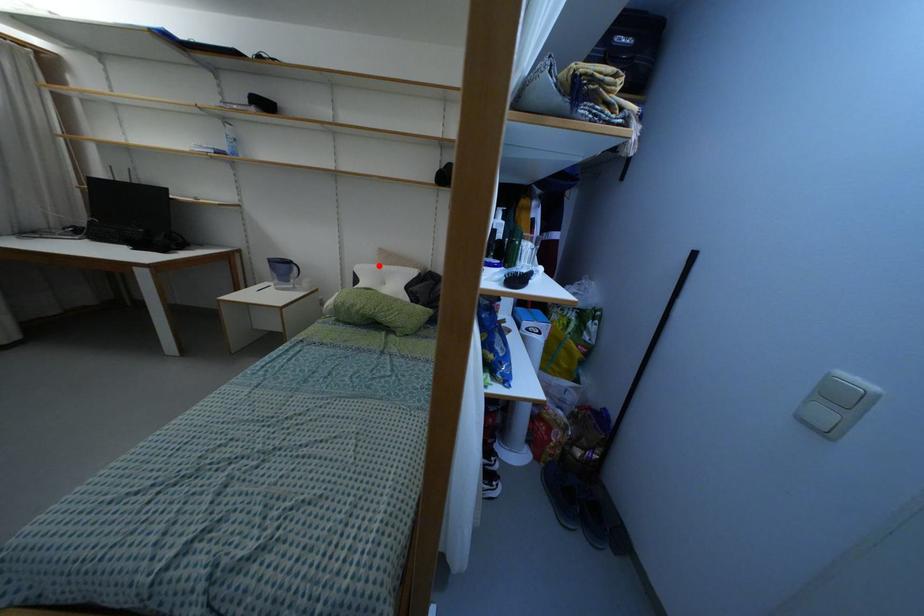
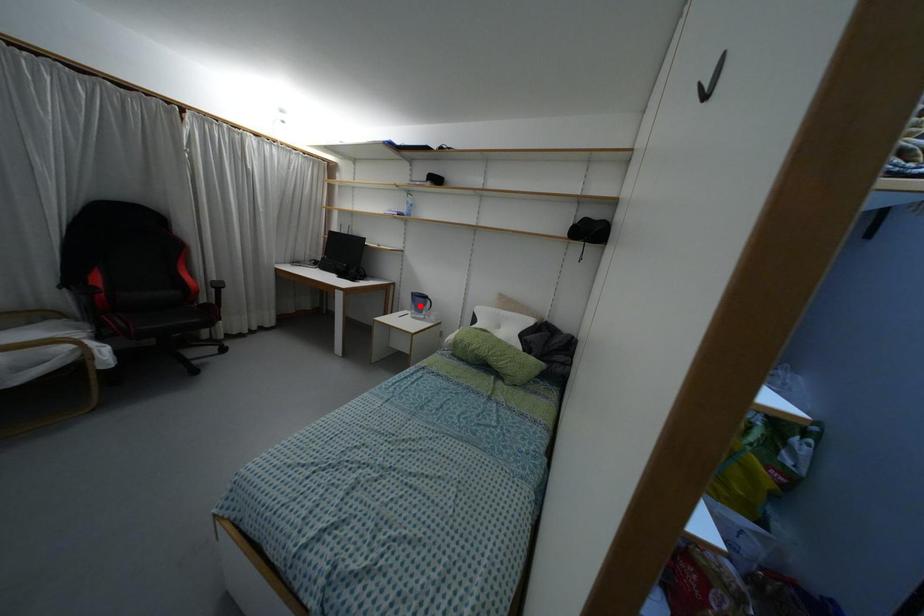
I am providing you with two images of the same scene from different viewpoints. A red point is marked on the first image and another point is marked on the second image. Is the marked point in image1 the same physical position as the marked point in image2?

No